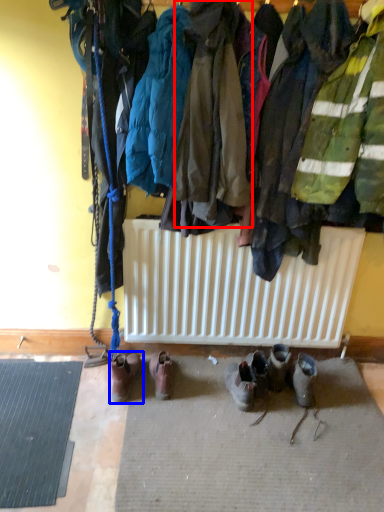
Question: Among these objects, which one is nearest to the camera, jacket (highlighted by a red box) or footwear (highlighted by a blue box)?

Choices:
 (A) jacket
 (B) footwear

Answer: (A)